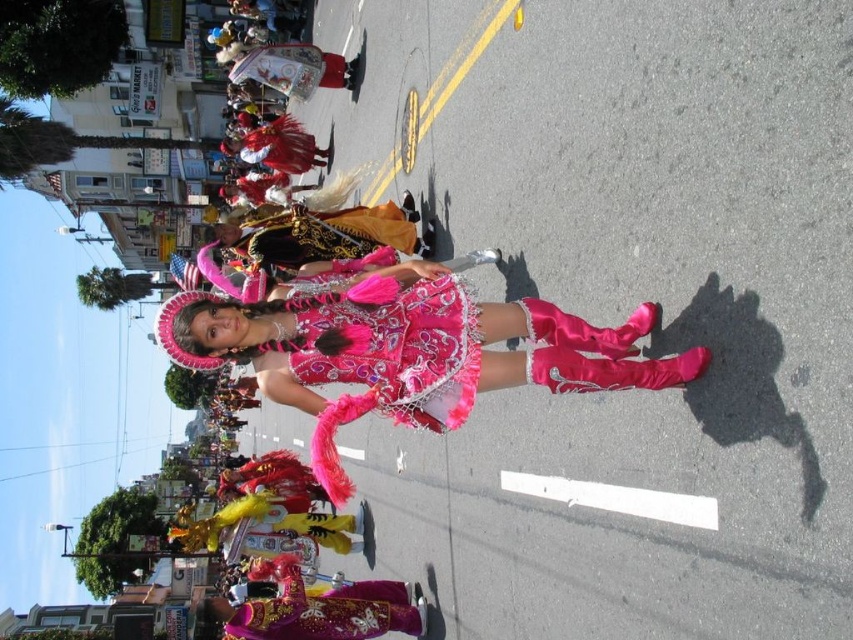
You are a photographer at the parade and want to capture both the shiny satin dress at center and the velvet gold and black vest at center in one frame. Which object should you position closer to the left side of your camera viewfinder to ensure both are visible?

To ensure both the shiny satin dress at center and the velvet gold and black vest at center are visible, position the shiny satin dress at center closer to the left side of your camera viewfinder since it is already to the left of the velvet gold and black vest at center in the scene.

You are a costume designer trying to decide which item to use for a performance. You have the shiny gold fabric at center and the velvet gold and black vest at center. Which item has a greater width?

The shiny gold fabric at center has a greater width than the velvet gold and black vest at center.

You are a photographer standing at the edge of the parade. You want to take a photo of both the shiny satin dress at center and the shiny gold fabric at center in the same frame. The camera you are using has a maximum focus range of 15 meters. Can you capture both objects in focus without moving your position?

The shiny satin dress at center is 15.19 meters away from the shiny gold fabric at center. Since the distance between them exceeds the camera maximum focus range of 15 meters, you cannot capture both objects in focus without moving your position.